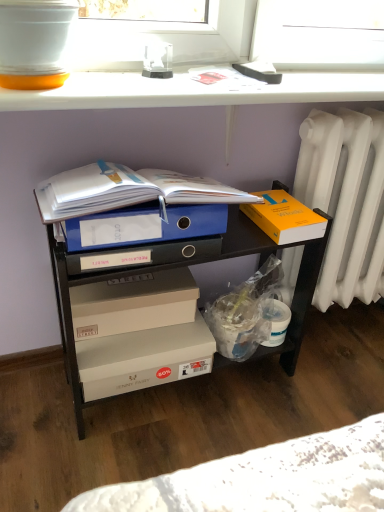
Where is `free spot to the right of blue plastic file at center`? This screenshot has width=384, height=512. free spot to the right of blue plastic file at center is located at coordinates (314, 390).